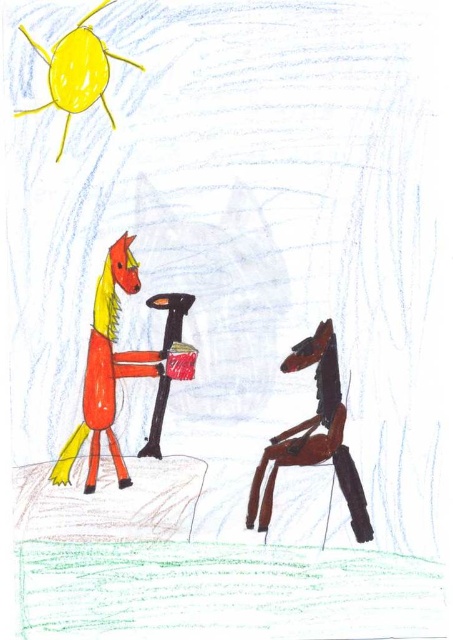
Question: Among these objects, which one is nearest to the camera?

Choices:
 (A) smooth orange horse at left
 (B) shiny brown horse at right

Answer: (B)

Question: Among these points, which one is nearest to the camera?

Choices:
 (A) (99, 422)
 (B) (56, 77)

Answer: (B)

Question: Which is nearer to the smooth orange horse at left?

Choices:
 (A) shiny brown horse at right
 (B) smooth yellow horse at upper left

Answer: (A)

Question: Is smooth orange horse at left to the left of smooth yellow horse at upper left from the viewer's perspective?

Choices:
 (A) no
 (B) yes

Answer: (A)

Question: Considering the relative positions of shiny brown horse at right and smooth yellow horse at upper left in the image provided, where is shiny brown horse at right located with respect to smooth yellow horse at upper left?

Choices:
 (A) left
 (B) right

Answer: (B)

Question: Does smooth orange horse at left come behind shiny brown horse at right?

Choices:
 (A) yes
 (B) no

Answer: (A)